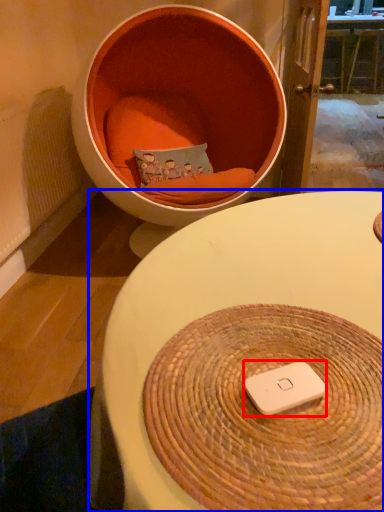
Question: Which object is closer to the camera taking this photo, ipod (highlighted by a red box) or table (highlighted by a blue box)?

Choices:
 (A) ipod
 (B) table

Answer: (B)